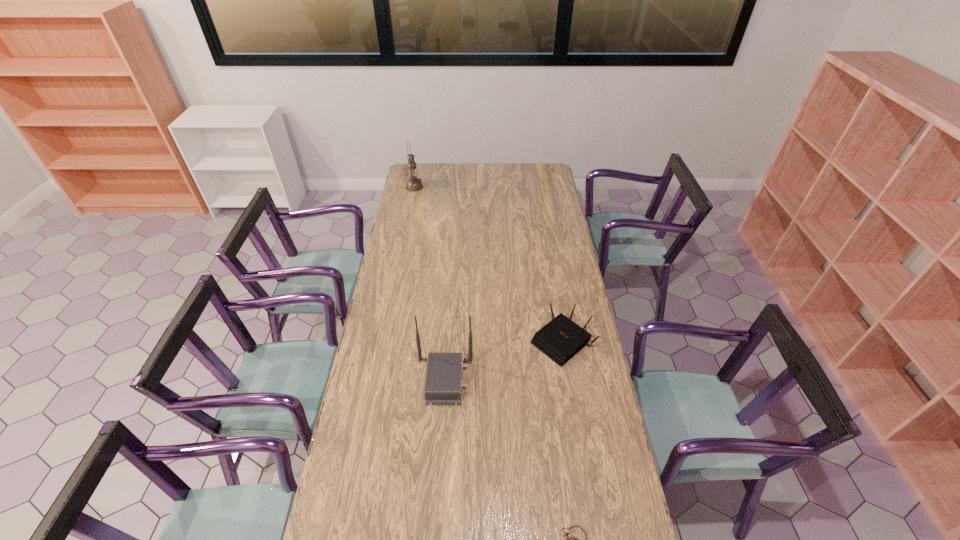
This screenshot has height=540, width=960. Identify the location of object at the left edge. (413, 184).

You are a GUI agent. You are given a task and a screenshot of the screen. Output one action in this format:
    pyautogui.click(x=<x>, y=<y>)
    Task: Click on the object that is at the right edge
    Image resolution: width=960 pixels, height=540 pixels.
    Given the screenshot: What is the action you would take?
    pyautogui.click(x=560, y=339)

This screenshot has height=540, width=960. What are the coordinates of `object at the far left corner` in the screenshot? It's located at (413, 184).

Image resolution: width=960 pixels, height=540 pixels. In the image, there is a desktop. What are the coordinates of `vacant space at the far edge` in the screenshot? It's located at (438, 176).

Locate an element on the screen. Image resolution: width=960 pixels, height=540 pixels. free point at the left edge is located at coordinates (389, 378).

The image size is (960, 540). I want to click on vacant space at the right edge, so click(569, 285).

In order to click on free region at the far right corner of the desktop in this screenshot , I will do `click(552, 182)`.

Find the location of a particular element. The height and width of the screenshot is (540, 960). blank region between the right router and the taller router is located at coordinates (503, 361).

Locate an element on the screen. blank region between the second tallest object and the third tallest object is located at coordinates (503, 361).

This screenshot has height=540, width=960. I want to click on vacant space that is in between the third tallest object and the third shortest object, so click(x=503, y=361).